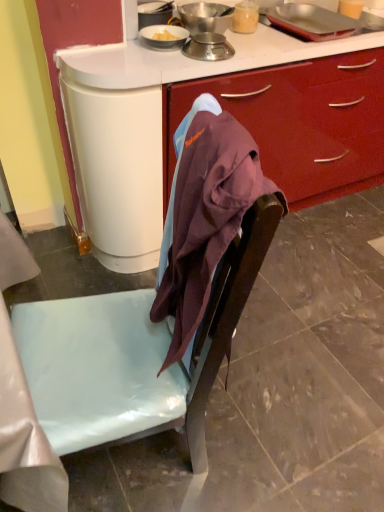
Question: Is metallic silver scale at upper center, which appears as the 2th kitchen appliance when viewed from the left, located outside matte brown chair at center?

Choices:
 (A) no
 (B) yes

Answer: (B)

Question: Does metallic silver scale at upper center, the 2th kitchen appliance positioned from the right, appear on the right side of matte brown chair at center?

Choices:
 (A) yes
 (B) no

Answer: (B)

Question: Does metallic silver scale at upper center, which appears as the 2th kitchen appliance when viewed from the left, lie behind matte brown chair at center?

Choices:
 (A) yes
 (B) no

Answer: (A)

Question: Is the position of metallic silver scale at upper center, the 2th kitchen appliance positioned from the right, less distant than that of matte brown chair at center?

Choices:
 (A) yes
 (B) no

Answer: (B)

Question: Is matte brown chair at center completely or partially inside metallic silver scale at upper center, the 2th kitchen appliance positioned from the right?

Choices:
 (A) yes
 (B) no

Answer: (B)

Question: Can you confirm if metallic silver scale at upper center, the 2th kitchen appliance positioned from the right, is wider than matte brown chair at center?

Choices:
 (A) yes
 (B) no

Answer: (B)

Question: Are metallic silver tray at upper right, which appears as the first kitchen appliance when viewed from the right, and metallic silver scale at upper center, which appears as the 2th kitchen appliance when viewed from the left, far apart?

Choices:
 (A) yes
 (B) no

Answer: (B)

Question: Considering the relative sizes of metallic silver tray at upper right, which appears as the first kitchen appliance when viewed from the right, and metallic silver scale at upper center, which appears as the 2th kitchen appliance when viewed from the left, in the image provided, is metallic silver tray at upper right, which appears as the first kitchen appliance when viewed from the right, bigger than metallic silver scale at upper center, which appears as the 2th kitchen appliance when viewed from the left,?

Choices:
 (A) yes
 (B) no

Answer: (A)

Question: From a real-world perspective, is metallic silver tray at upper right, positioned as the 3th kitchen appliance in left-to-right order, physically above metallic silver scale at upper center, the 2th kitchen appliance positioned from the right?

Choices:
 (A) no
 (B) yes

Answer: (B)

Question: Does metallic silver tray at upper right, positioned as the 3th kitchen appliance in left-to-right order, have a lesser width compared to metallic silver scale at upper center, which appears as the 2th kitchen appliance when viewed from the left?

Choices:
 (A) no
 (B) yes

Answer: (A)

Question: Is metallic silver tray at upper right, positioned as the 3th kitchen appliance in left-to-right order, at the right side of metallic silver scale at upper center, the 2th kitchen appliance positioned from the right?

Choices:
 (A) no
 (B) yes

Answer: (B)

Question: From a real-world perspective, is metallic silver tray at upper right, which appears as the first kitchen appliance when viewed from the right, physically below metallic silver scale at upper center, the 2th kitchen appliance positioned from the right?

Choices:
 (A) no
 (B) yes

Answer: (A)

Question: Can you confirm if metallic silver tray at upper right, positioned as the 3th kitchen appliance in left-to-right order, is shorter than metallic silver scale at upper center, the first kitchen appliance in the left-to-right sequence?

Choices:
 (A) no
 (B) yes

Answer: (B)